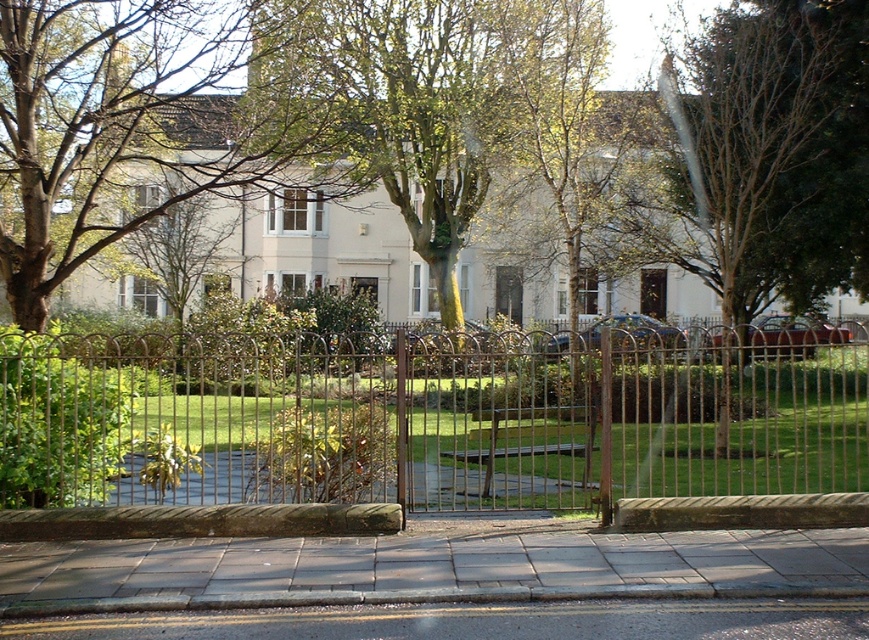
Between point (834, 140) and point (163, 616), which one is positioned behind?

Positioned behind is point (834, 140).

Which is in front, point (695, 141) or point (383, 611)?

Point (383, 611)

At what (x,y) coordinates should I click in order to perform the action: click on green leafy tree at center. Please return your answer as a coordinate pair (x, y). Looking at the image, I should click on (760, 156).

Is gray concrete pavement at lower center to the right of brown wooden door at center from the viewer's perspective?

Incorrect, gray concrete pavement at lower center is not on the right side of brown wooden door at center.

Is gray concrete pavement at lower center smaller than brown wooden door at center?

Indeed, gray concrete pavement at lower center has a smaller size compared to brown wooden door at center.

Identify the location of gray concrete pavement at lower center. This screenshot has height=640, width=869. (481, 621).

In order to click on gray concrete pavement at lower center in this screenshot , I will do `click(481, 621)`.

Is point (149, 84) closer to viewer compared to point (678, 636)?

No.

Is green leafy tree at upper center thinner than gray concrete pavement at lower center?

No.

Where is `green leafy tree at upper center`? The height and width of the screenshot is (640, 869). green leafy tree at upper center is located at coordinates (143, 122).